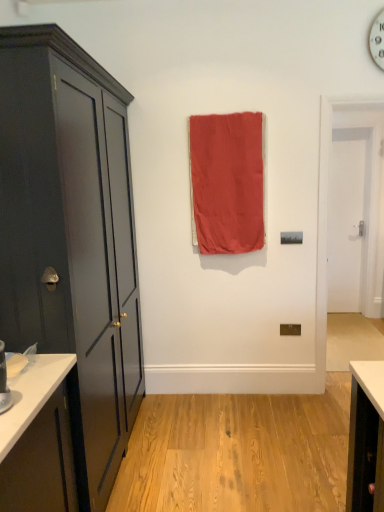
You are a GUI agent. You are given a task and a screenshot of the screen. Output one action in this format:
    pyautogui.click(x=<x>, y=<y>)
    Task: Click on the matte dark gray cabinet at left
    The height and width of the screenshot is (512, 384).
    Given the screenshot: What is the action you would take?
    pyautogui.click(x=71, y=232)

Identify the location of coral fabric curtain at center. (227, 182).

Considering the relative sizes of matte dark gray cabinet at left and coral fabric curtain at center in the image provided, is matte dark gray cabinet at left smaller than coral fabric curtain at center?

No, matte dark gray cabinet at left is not smaller than coral fabric curtain at center.

Can you tell me how much matte dark gray cabinet at left and coral fabric curtain at center differ in facing direction?

The angular difference between matte dark gray cabinet at left and coral fabric curtain at center is 87.8 degrees.

Considering the relative sizes of matte dark gray cabinet at left and coral fabric curtain at center in the image provided, is matte dark gray cabinet at left wider than coral fabric curtain at center?

Indeed, matte dark gray cabinet at left has a greater width compared to coral fabric curtain at center.

The image size is (384, 512). In order to click on cabinetry in front of the coral fabric curtain at center in this screenshot , I will do `click(71, 232)`.

Does matte dark gray cabinet at left turn towards white smooth door at right?

No, matte dark gray cabinet at left does not turn towards white smooth door at right.

Between matte dark gray cabinet at left and white smooth door at right, which one has less height?

white smooth door at right is shorter.

In the scene shown: Does matte dark gray cabinet at left lie behind white smooth door at right?

No, the depth of matte dark gray cabinet at left is less than that of white smooth door at right.

Considering the relative positions of white smooth door at right and coral fabric curtain at center in the image provided, is white smooth door at right to the left or to the right of coral fabric curtain at center?

Clearly, white smooth door at right is on the right of coral fabric curtain at center in the image.

From a real-world perspective, between white smooth door at right and coral fabric curtain at center, who is vertically higher?

coral fabric curtain at center, from a real-world perspective.

Which of these two, white smooth door at right or coral fabric curtain at center, is bigger?

coral fabric curtain at center is bigger.

You are a GUI agent. You are given a task and a screenshot of the screen. Output one action in this format:
    pyautogui.click(x=<x>, y=<y>)
    Task: Click on the cabinetry that appears below the white smooth door at right (from the image's perspective)
    The width and height of the screenshot is (384, 512).
    Given the screenshot: What is the action you would take?
    pyautogui.click(x=71, y=232)

Is white smooth door at right oriented towards matte dark gray cabinet at left?

No, white smooth door at right is not aimed at matte dark gray cabinet at left.

How different are the orientations of white smooth door at right and matte dark gray cabinet at left in degrees?

They differ by 89.5 degrees in their facing directions.

Measure the distance between coral fabric curtain at center and white smooth door at right.

coral fabric curtain at center is 6.84 feet from white smooth door at right.

Considering the positions of points (247, 184) and (339, 187), is point (247, 184) closer to camera compared to point (339, 187)?

Yes, it is in front of point (339, 187).

Consider the image. Is coral fabric curtain at center aimed at white smooth door at right?

No, coral fabric curtain at center does not turn towards white smooth door at right.

Choose the correct answer: Is coral fabric curtain at center inside white smooth door at right or outside it?

coral fabric curtain at center is located beyond the bounds of white smooth door at right.

Could matte dark gray cabinet at left be considered to be inside coral fabric curtain at center?

No, matte dark gray cabinet at left is not inside coral fabric curtain at center.

Does coral fabric curtain at center have a smaller size compared to matte dark gray cabinet at left?

Correct, coral fabric curtain at center occupies less space than matte dark gray cabinet at left.

Consider the image. In terms of height, does coral fabric curtain at center look taller or shorter compared to matte dark gray cabinet at left?

coral fabric curtain at center is shorter than matte dark gray cabinet at left.

How different are the orientations of coral fabric curtain at center and matte dark gray cabinet at left in degrees?

87.8 degrees.

Where is `cabinetry in front of the coral fabric curtain at center`? The image size is (384, 512). cabinetry in front of the coral fabric curtain at center is located at coordinates (71, 232).

Identify the location of door that is above the matte dark gray cabinet at left (from the image's perspective). The image size is (384, 512). (348, 218).

From the picture: Which object lies nearer to the anchor point coral fabric curtain at center, matte dark gray cabinet at left or white smooth door at right?

The object closer to coral fabric curtain at center is matte dark gray cabinet at left.

From the image, which object appears to be farther from coral fabric curtain at center, white smooth door at right or matte dark gray cabinet at left?

white smooth door at right is further to coral fabric curtain at center.

Looking at the image, which one is located further to matte dark gray cabinet at left, coral fabric curtain at center or white smooth door at right?

white smooth door at right is positioned further to the anchor matte dark gray cabinet at left.

Estimate the real-world distances between objects in this image. Which object is closer to matte dark gray cabinet at left, white smooth door at right or coral fabric curtain at center?

coral fabric curtain at center is closer to matte dark gray cabinet at left.

Looking at the image, which one is located further to white smooth door at right, matte dark gray cabinet at left or coral fabric curtain at center?

Based on the image, matte dark gray cabinet at left appears to be further to white smooth door at right.

When comparing their distances from white smooth door at right, does coral fabric curtain at center or matte dark gray cabinet at left seem closer?

coral fabric curtain at center is closer to white smooth door at right.

Where is `curtain between matte dark gray cabinet at left and white smooth door at right in the front-back direction`? The height and width of the screenshot is (512, 384). curtain between matte dark gray cabinet at left and white smooth door at right in the front-back direction is located at coordinates (227, 182).